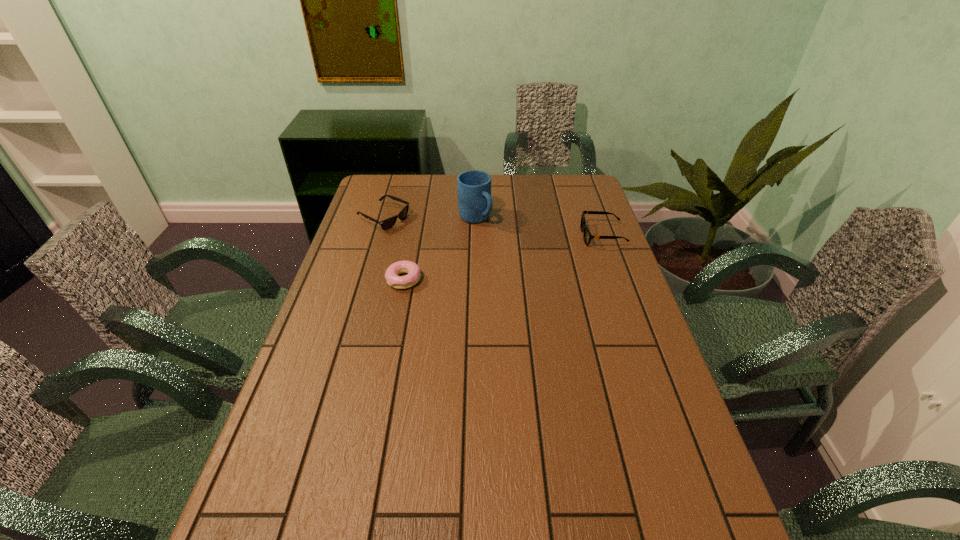
You are a GUI agent. You are given a task and a screenshot of the screen. Output one action in this format:
    pyautogui.click(x=<x>, y=<y>)
    Task: Click on the vacant space on the desktop that is between the nearest object and the right sunglasses and is positioned on the side of the tallest object with the handle
    The image size is (960, 540).
    Given the screenshot: What is the action you would take?
    pyautogui.click(x=516, y=255)

This screenshot has width=960, height=540. I want to click on free spot on the desktop that is between the shortest object and the right sunglasses and is positioned on the front-facing side of the left sunglasses, so click(486, 261).